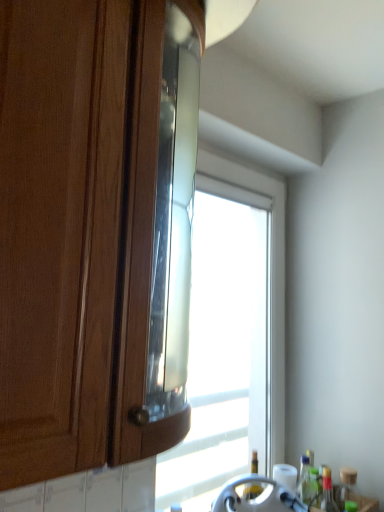
Question: Is translucent glass bottle at lower right, which appears as the first bottle when viewed from the right, spatially inside transparent glass window at center, or outside of it?

Choices:
 (A) outside
 (B) inside

Answer: (A)

Question: From the image's perspective, relative to transparent glass window at center, is translucent glass bottle at lower right, the 3th bottle positioned from the left, above or below?

Choices:
 (A) above
 (B) below

Answer: (B)

Question: Which object is positioned closest to the transparent glass window at center?

Choices:
 (A) transparent glass bottle at lower right, placed as the 1th bottle when sorted from left to right
 (B) translucent glass bottle at lower right, the 3th bottle positioned from the left
 (C) translucent plastic bottle at lower right, the second bottle viewed from the right
 (D) metallic silver faucet at lower center
 (E) matte wood cabinet at left

Answer: (A)

Question: Which object is positioned closest to the metallic silver faucet at lower center?

Choices:
 (A) matte wood cabinet at left
 (B) translucent plastic bottle at lower right, the second bottle when ordered from left to right
 (C) transparent glass bottle at lower right, placed as the 1th bottle when sorted from left to right
 (D) translucent glass bottle at lower right, which appears as the first bottle when viewed from the right
 (E) transparent glass window at center

Answer: (C)